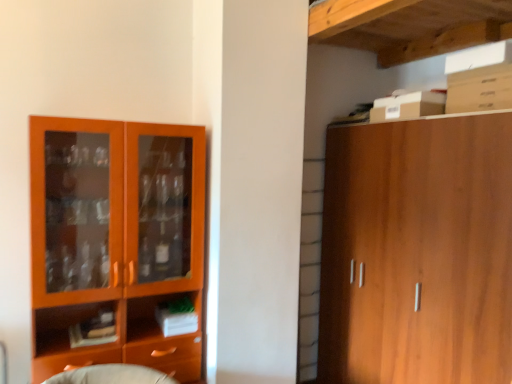
Question: Is wooden cabinet at right with orange wood cabinet at left?

Choices:
 (A) no
 (B) yes

Answer: (A)

Question: Is wooden cabinet at right thinner than orange wood cabinet at left?

Choices:
 (A) no
 (B) yes

Answer: (A)

Question: Is the depth of wooden cabinet at right less than that of orange wood cabinet at left?

Choices:
 (A) no
 (B) yes

Answer: (B)

Question: Is wooden cabinet at right not within orange wood cabinet at left?

Choices:
 (A) no
 (B) yes

Answer: (B)

Question: Could you tell me if wooden cabinet at right is turned towards orange wood cabinet at left?

Choices:
 (A) no
 (B) yes

Answer: (B)

Question: Can you confirm if wooden cabinet at right is positioned to the right of orange wood cabinet at left?

Choices:
 (A) no
 (B) yes

Answer: (B)

Question: Is white cardboard box at upper right positioned with its back to orange wood cabinet at left?

Choices:
 (A) yes
 (B) no

Answer: (B)

Question: Can you confirm if white cardboard box at upper right is wider than orange wood cabinet at left?

Choices:
 (A) yes
 (B) no

Answer: (B)

Question: Is white cardboard box at upper right positioned behind orange wood cabinet at left?

Choices:
 (A) yes
 (B) no

Answer: (A)

Question: Is white cardboard box at upper right taller than orange wood cabinet at left?

Choices:
 (A) yes
 (B) no

Answer: (B)

Question: Is white cardboard box at upper right at the right side of orange wood cabinet at left?

Choices:
 (A) yes
 (B) no

Answer: (A)

Question: From the image's perspective, is white cardboard box at upper right below orange wood cabinet at left?

Choices:
 (A) yes
 (B) no

Answer: (B)

Question: From the image's perspective, does white cardboard box at upper right appear lower than wooden cabinet at right?

Choices:
 (A) yes
 (B) no

Answer: (B)